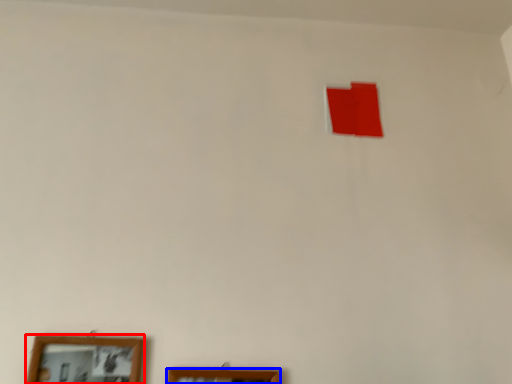
Question: Which object is further to the camera taking this photo, picture frame (highlighted by a red box) or picture frame (highlighted by a blue box)?

Choices:
 (A) picture frame
 (B) picture frame

Answer: (B)